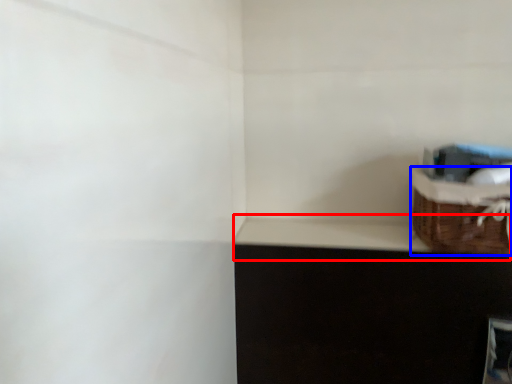
Question: Which of the following is the closest to the observer, window sill (highlighted by a red box) or basket (highlighted by a blue box)?

Choices:
 (A) window sill
 (B) basket

Answer: (B)